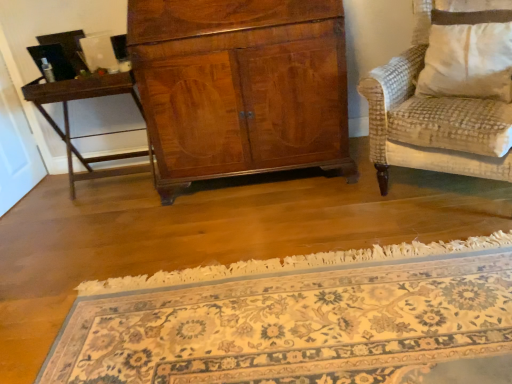
What do you see at coordinates (68, 117) in the screenshot? I see `dark brown wood table at left` at bounding box center [68, 117].

Measure the distance between floral carpet at center and camera.

The distance of floral carpet at center from camera is 1.20 meters.

You are a GUI agent. You are given a task and a screenshot of the screen. Output one action in this format:
    pyautogui.click(x=<x>, y=<y>)
    Task: Click on the floral carpet at center
    This screenshot has height=384, width=512.
    Given the screenshot: What is the action you would take?
    pyautogui.click(x=300, y=320)

This screenshot has width=512, height=384. Describe the element at coordinates (468, 54) in the screenshot. I see `white textured pillow at right` at that location.

You are a GUI agent. You are given a task and a screenshot of the screen. Output one action in this format:
    pyautogui.click(x=<x>, y=<y>)
    Task: Click on the dark brown wood table at left
    This screenshot has height=384, width=512.
    Given the screenshot: What is the action you would take?
    pyautogui.click(x=68, y=117)

Is floral carpet at center closer to the viewer compared to white textured pillow at right?

Yes, floral carpet at center is closer to the camera.

Based on the photo, from the image's perspective, is floral carpet at center located above or below white textured pillow at right?

Based on their image positions, floral carpet at center is located beneath white textured pillow at right.

From a real-world perspective, is floral carpet at center physically above white textured pillow at right?

No, from a real-world perspective, floral carpet at center is not above white textured pillow at right.

From a real-world perspective, between white textured pillow at right and dark brown wood table at left, who is vertically lower?

dark brown wood table at left, from a real-world perspective.

The image size is (512, 384). Find the location of `pillow in front of the dark brown wood table at left`. pillow in front of the dark brown wood table at left is located at coordinates (468, 54).

Considering the points (466, 76) and (117, 155), which point is behind, point (466, 76) or point (117, 155)?

Point (117, 155)

Is white textured pillow at right directly adjacent to dark brown wood table at left?

There is a gap between white textured pillow at right and dark brown wood table at left.

Could you tell me if white textured pillow at right is facing floral carpet at center?

No, white textured pillow at right is not turned towards floral carpet at center.

In terms of width, does white textured pillow at right look wider or thinner when compared to floral carpet at center?

Considering their sizes, white textured pillow at right looks slimmer than floral carpet at center.

Which is nearer, [475,63] or [199,380]?

Point [475,63] is farther from the camera than point [199,380].

Based on the photo, choose the correct answer: Is floral carpet at center inside dark brown wood table at left or outside it?

floral carpet at center is not inside dark brown wood table at left, it's outside.

Looking at this image, which object is thinner, floral carpet at center or dark brown wood table at left?

Thinner between the two is dark brown wood table at left.

From the picture: Does floral carpet at center have a larger size compared to dark brown wood table at left?

Correct, floral carpet at center is larger in size than dark brown wood table at left.

Is floral carpet at center aimed at dark brown wood table at left?

No, floral carpet at center is not oriented towards dark brown wood table at left.

From a real-world perspective, does dark brown wood table at left sit lower than floral carpet at center?

Actually, dark brown wood table at left is physically above floral carpet at center in the real world.

Does dark brown wood table at left lie in front of floral carpet at center?

No, it is not.

Would you consider dark brown wood table at left to be distant from floral carpet at center?

Yes.

How far apart are dark brown wood table at left and white textured pillow at right?

dark brown wood table at left is 5.21 feet from white textured pillow at right.

Considering the positions of objects dark brown wood table at left and white textured pillow at right in the image provided, who is more to the left, dark brown wood table at left or white textured pillow at right?

dark brown wood table at left.

Considering their positions, is dark brown wood table at left located in front of or behind white textured pillow at right?

Clearly, dark brown wood table at left is behind white textured pillow at right.

From a real-world perspective, is dark brown wood table at left positioned under white textured pillow at right based on gravity?

Correct, in the physical world, dark brown wood table at left is lower than white textured pillow at right.

The height and width of the screenshot is (384, 512). I want to click on pillow above the floral carpet at center (from a real-world perspective), so click(x=468, y=54).

Where is `table behind the white textured pillow at right`? table behind the white textured pillow at right is located at coordinates (68, 117).

Based on their spatial positions, is white textured pillow at right or floral carpet at center closer to dark brown wood table at left?

floral carpet at center is closer to dark brown wood table at left.

When comparing their distances from white textured pillow at right, does dark brown wood table at left or floral carpet at center seem further?

Among the two, dark brown wood table at left is located further to white textured pillow at right.

Based on the photo, based on their spatial positions, is floral carpet at center or dark brown wood table at left closer to white textured pillow at right?

Based on the image, floral carpet at center appears to be nearer to white textured pillow at right.

When comparing their distances from floral carpet at center, does dark brown wood table at left or white textured pillow at right seem closer?

white textured pillow at right.

Which object lies further to the anchor point floral carpet at center, white textured pillow at right or dark brown wood table at left?

dark brown wood table at left is positioned further to the anchor floral carpet at center.

From the image, which object appears to be farther from dark brown wood table at left, floral carpet at center or white textured pillow at right?

white textured pillow at right is further to dark brown wood table at left.

What are the coordinates of `mat between dark brown wood table at left and white textured pillow at right in the horizontal direction` in the screenshot? It's located at pyautogui.click(x=300, y=320).